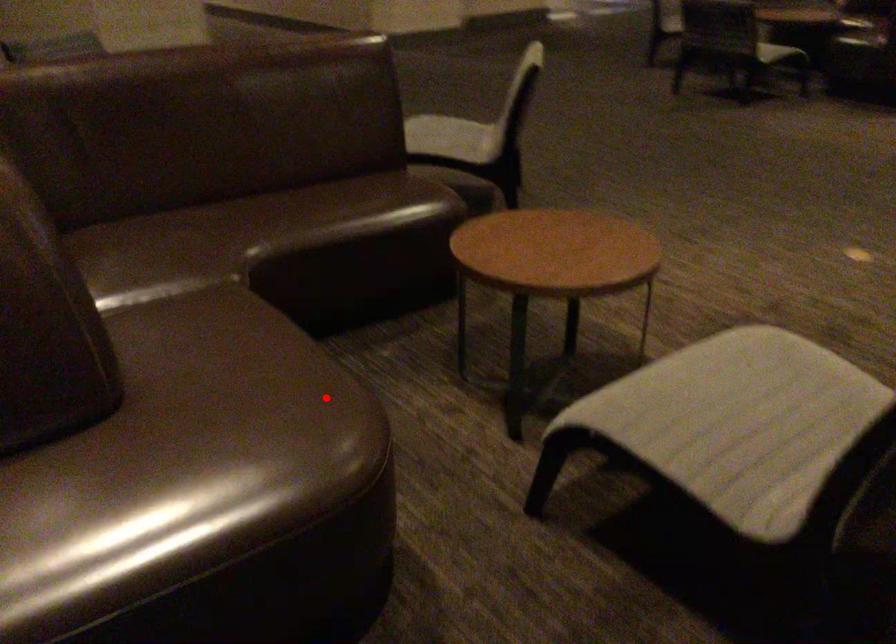
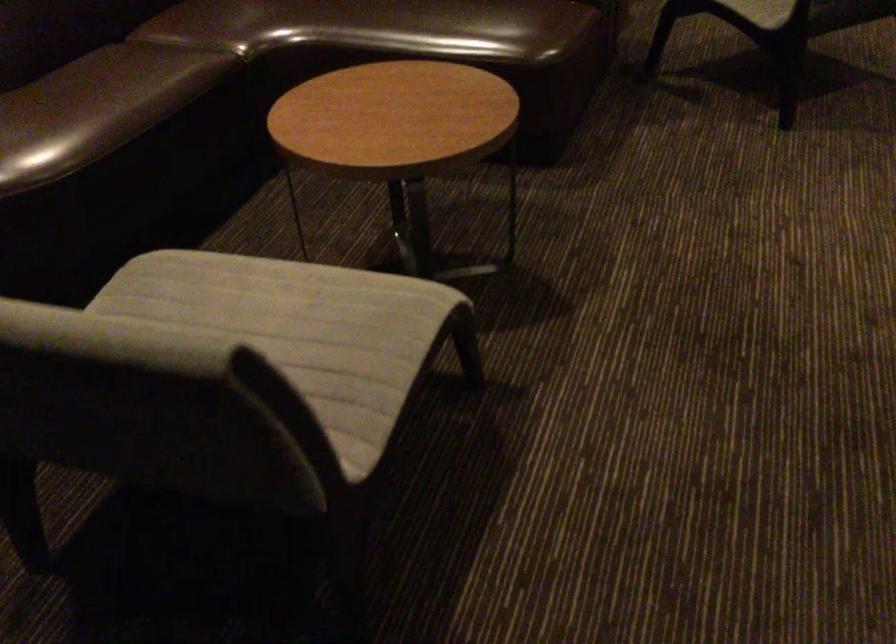
In the second image, find the point that corresponds to the highlighted location in the first image.

(42, 138)